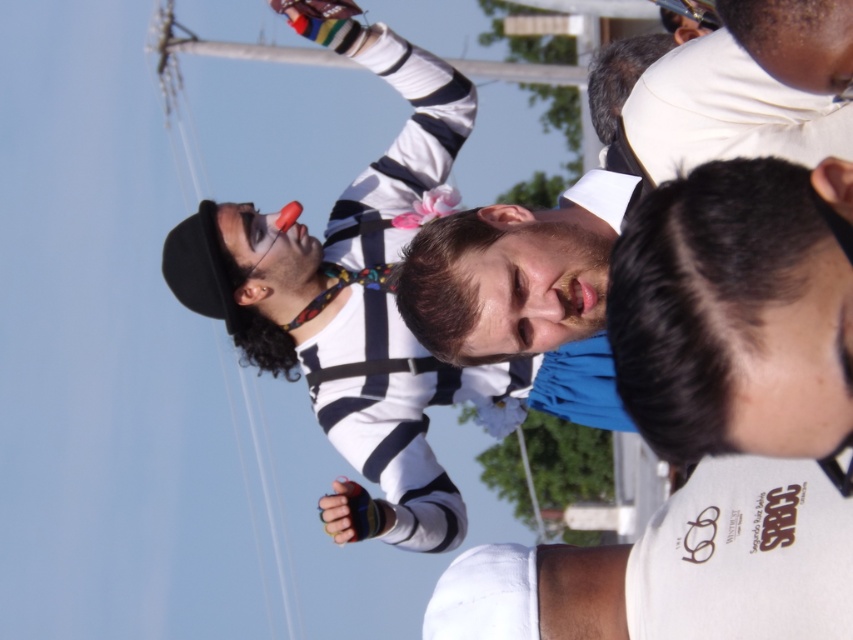
Question: Does matte striped shirt at left have a greater width compared to white striped pole at upper center?

Choices:
 (A) yes
 (B) no

Answer: (B)

Question: Which point appears farthest from the camera in this image?

Choices:
 (A) (294, 56)
 (B) (434, 179)

Answer: (A)

Question: Can you confirm if matte striped shirt at left is positioned above white striped pole at upper center?

Choices:
 (A) yes
 (B) no

Answer: (B)

Question: Which object is closer to the camera taking this photo?

Choices:
 (A) white striped pole at upper center
 (B) matte striped shirt at left

Answer: (B)

Question: Does matte striped shirt at left appear over white striped pole at upper center?

Choices:
 (A) no
 (B) yes

Answer: (A)